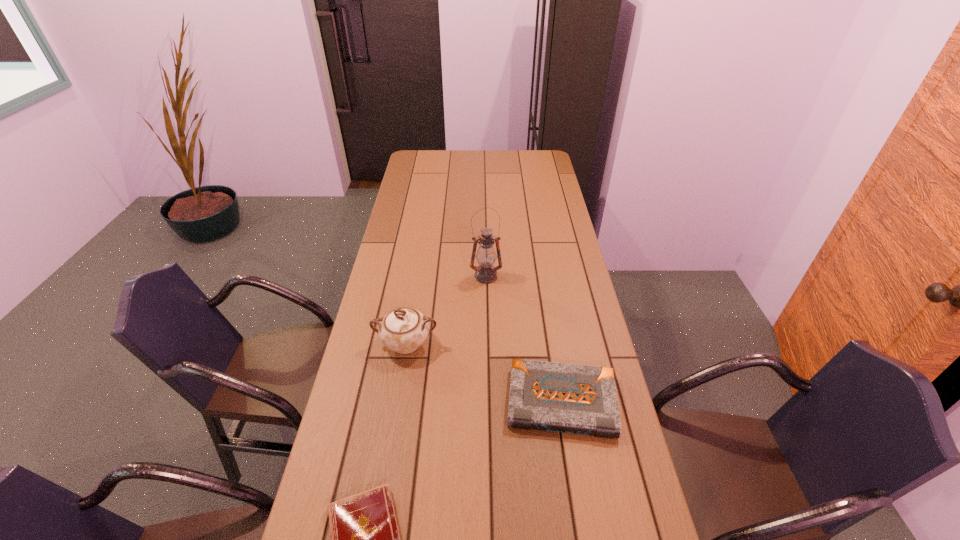
Find the location of a particular element. free spot between the taller notebook and the farthest object is located at coordinates (524, 339).

This screenshot has width=960, height=540. In order to click on the second closest object to the third nearest object in this screenshot , I will do `click(485, 273)`.

Locate which object ranks second in proximity to the taller notebook. Please provide its 2D coordinates. Your answer should be formatted as a tuple, i.e. [(x, y)], where the tuple contains the x and y coordinates of a point satisfying the conditions above.

[(365, 539)]

Identify the location of blank area in the image that satisfies the following two spatial constraints: 1. on the front side of the second nearest object; 2. on the right side of the farthest object. This screenshot has width=960, height=540. (488, 402).